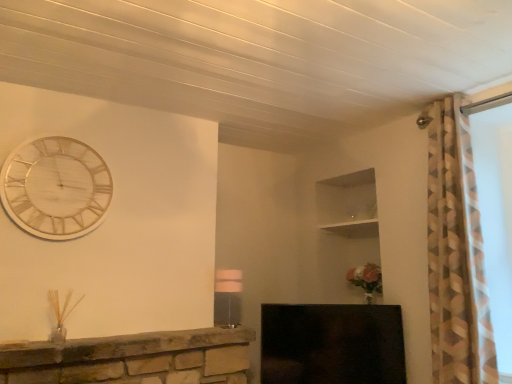
Question: Considering the relative sizes of wooden/textured clock at upper left and black glossy fireplace at lower center in the image provided, is wooden/textured clock at upper left shorter than black glossy fireplace at lower center?

Choices:
 (A) yes
 (B) no

Answer: (B)

Question: Is wooden/textured clock at upper left positioned with its back to black glossy fireplace at lower center?

Choices:
 (A) no
 (B) yes

Answer: (A)

Question: Is wooden/textured clock at upper left outside of black glossy fireplace at lower center?

Choices:
 (A) yes
 (B) no

Answer: (A)

Question: From a real-world perspective, is wooden/textured clock at upper left beneath black glossy fireplace at lower center?

Choices:
 (A) no
 (B) yes

Answer: (A)

Question: Is wooden/textured clock at upper left positioned behind black glossy fireplace at lower center?

Choices:
 (A) yes
 (B) no

Answer: (B)

Question: Does wooden/textured clock at upper left touch black glossy fireplace at lower center?

Choices:
 (A) no
 (B) yes

Answer: (A)

Question: From a real-world perspective, is black glossy fireplace at lower center on top of wooden/textured clock at upper left?

Choices:
 (A) yes
 (B) no

Answer: (B)

Question: Does black glossy fireplace at lower center have a lesser width compared to wooden/textured clock at upper left?

Choices:
 (A) no
 (B) yes

Answer: (A)

Question: Does black glossy fireplace at lower center appear on the left side of wooden/textured clock at upper left?

Choices:
 (A) yes
 (B) no

Answer: (B)

Question: Does black glossy fireplace at lower center have a lesser height compared to wooden/textured clock at upper left?

Choices:
 (A) no
 (B) yes

Answer: (B)

Question: Is black glossy fireplace at lower center in front of wooden/textured clock at upper left?

Choices:
 (A) no
 (B) yes

Answer: (A)

Question: From a real-world perspective, is black glossy fireplace at lower center below wooden/textured clock at upper left?

Choices:
 (A) yes
 (B) no

Answer: (A)

Question: Does matte white lampshade at center have a lesser width compared to wooden/textured clock at upper left?

Choices:
 (A) no
 (B) yes

Answer: (A)